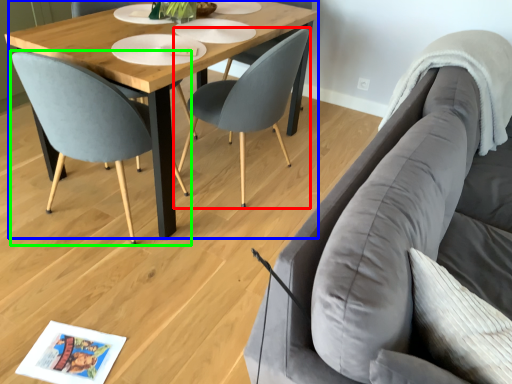
Question: Based on their relative distances, which object is farther from chair (highlighted by a red box)? Choose from coffee table (highlighted by a blue box) and chair (highlighted by a green box).

Choices:
 (A) coffee table
 (B) chair

Answer: (B)